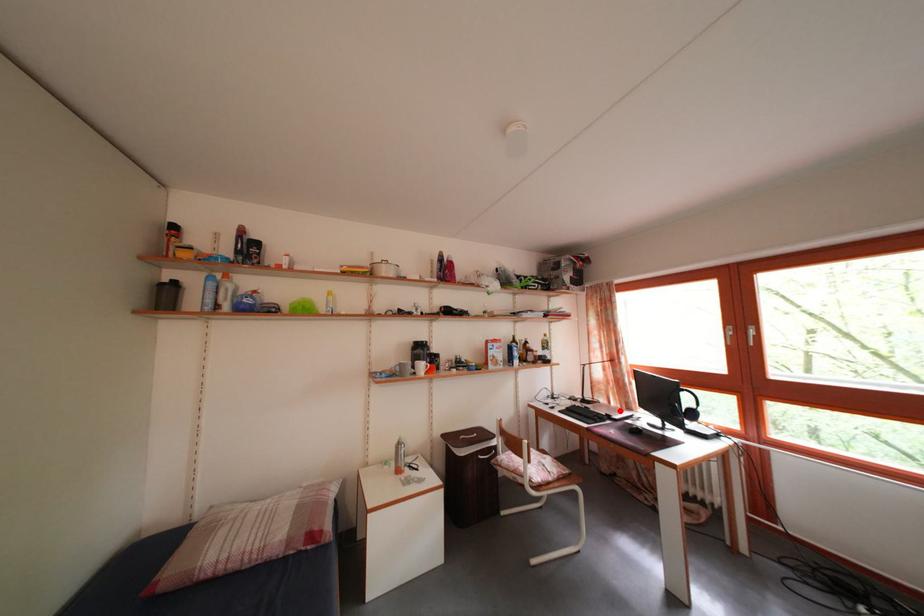
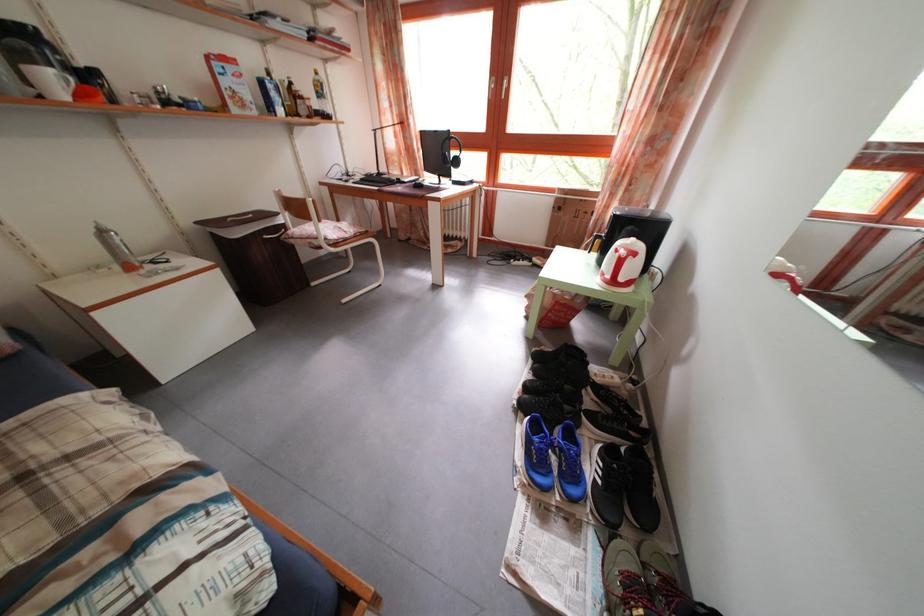
Where in the second image is the point corresponding to the highlighted location from the first image?

(412, 182)